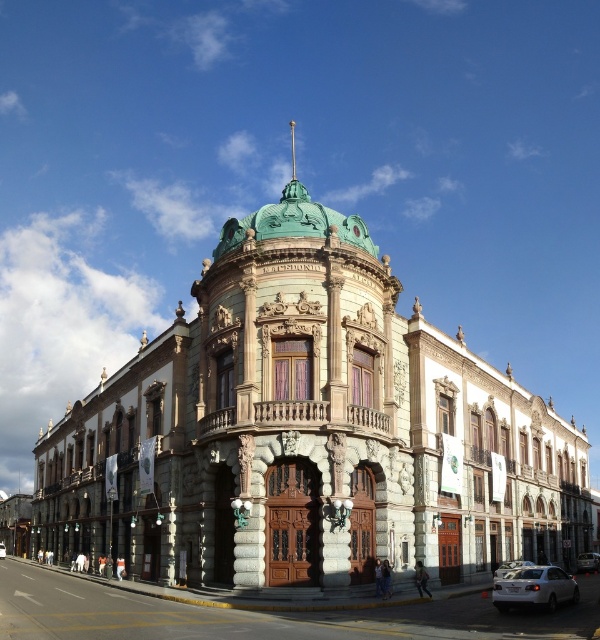
Does white glossy sedan at center have a lesser width compared to white glossy car at center?

Yes, white glossy sedan at center is thinner than white glossy car at center.

From the picture: Does white glossy sedan at center have a lesser height compared to white glossy car at center?

Yes.

The height and width of the screenshot is (640, 600). In order to click on white glossy sedan at center in this screenshot , I will do `click(511, 566)`.

Where is `white glossy sedan at center`? white glossy sedan at center is located at coordinates click(511, 566).

Is white matte sedan at lower right shorter than white glossy car at center?

Indeed, white matte sedan at lower right has a lesser height compared to white glossy car at center.

Looking at this image, can you confirm if white matte sedan at lower right is taller than white glossy car at center?

No.

Is point (555, 608) more distant than point (1, 548)?

No.

The height and width of the screenshot is (640, 600). What are the coordinates of `white matte sedan at lower right` in the screenshot? It's located at (535, 588).

Does satin silver sedan at center appear over white glossy sedan at center?

Incorrect, satin silver sedan at center is not positioned above white glossy sedan at center.

Locate an element on the screen. satin silver sedan at center is located at coordinates (588, 561).